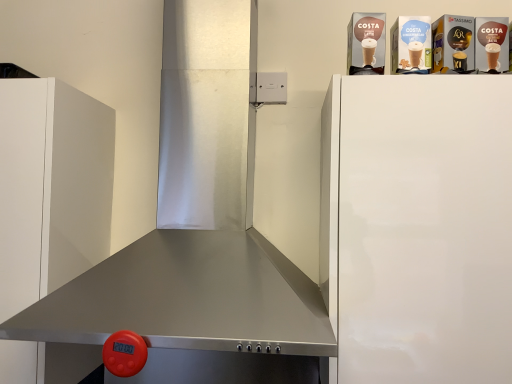
Question: In the image, is stainless steel exhaust hood at center positioned in front of or behind white matte cabinet at left?

Choices:
 (A) front
 (B) behind

Answer: (A)

Question: From the image's perspective, is stainless steel exhaust hood at center above or below white matte cabinet at left?

Choices:
 (A) above
 (B) below

Answer: (A)

Question: Which of these objects is positioned closest to the stainless steel exhaust hood at center?

Choices:
 (A) white matte cabinet at left
 (B) white glossy refrigerator at upper right

Answer: (B)

Question: Which object is the farthest from the white glossy refrigerator at upper right?

Choices:
 (A) white matte cabinet at left
 (B) stainless steel exhaust hood at center

Answer: (A)